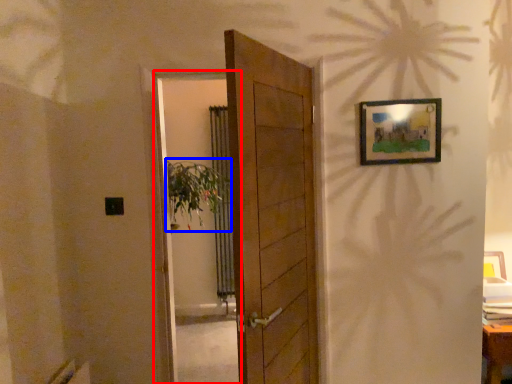
Question: Which object is further to the camera taking this photo, screen door (highlighted by a red box) or plant (highlighted by a blue box)?

Choices:
 (A) screen door
 (B) plant

Answer: (B)